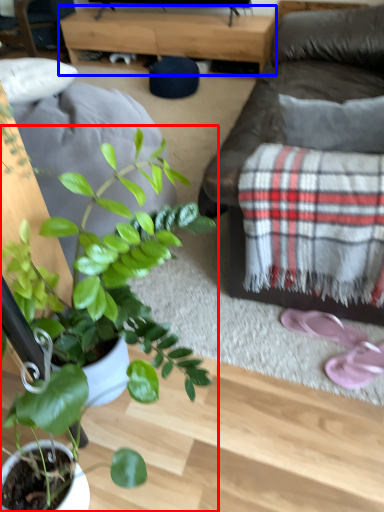
Question: Among these objects, which one is farthest to the camera, houseplant (highlighted by a red box) or table (highlighted by a blue box)?

Choices:
 (A) houseplant
 (B) table

Answer: (B)